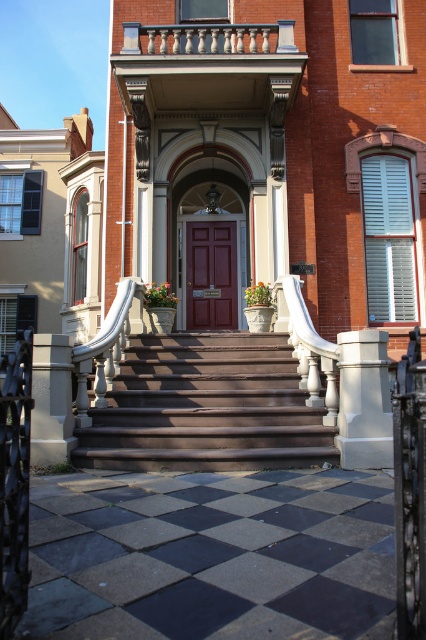
Does white stone pillar at lower left appear on the right side of white marble balustrade at upper center?

Incorrect, white stone pillar at lower left is not on the right side of white marble balustrade at upper center.

Is point (45, 356) closer to viewer compared to point (141, 28)?

That is True.

Locate an element on the screen. This screenshot has width=426, height=640. white stone pillar at lower left is located at coordinates (51, 400).

Between white stone column at center and white stone pillar at lower left, which one has more height?

With more height is white stone column at center.

Is white stone column at center taller than white stone pillar at lower left?

Indeed, white stone column at center has a greater height compared to white stone pillar at lower left.

Locate an element on the screen. This screenshot has width=426, height=640. white stone column at center is located at coordinates (363, 401).

The width and height of the screenshot is (426, 640). What are the coordinates of `white stone column at center` in the screenshot? It's located at (363, 401).

Is matte wood door at center below white marble balustrade at upper center?

Correct, matte wood door at center is located below white marble balustrade at upper center.

Is matte wood door at center to the right of white marble balustrade at upper center from the viewer's perspective?

Yes, matte wood door at center is to the right of white marble balustrade at upper center.

Between point (212, 240) and point (141, 35), which one is positioned in front?

Positioned in front is point (141, 35).

Locate an element on the screen. matte wood door at center is located at coordinates (210, 275).